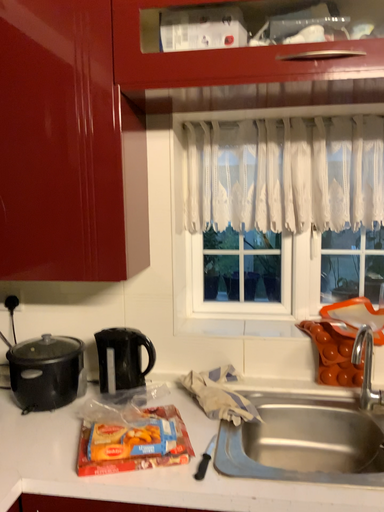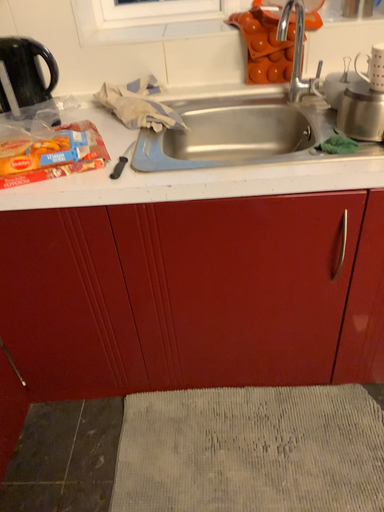
Question: Which way did the camera rotate in the video?

Choices:
 (A) rotated downward
 (B) rotated upward

Answer: (A)